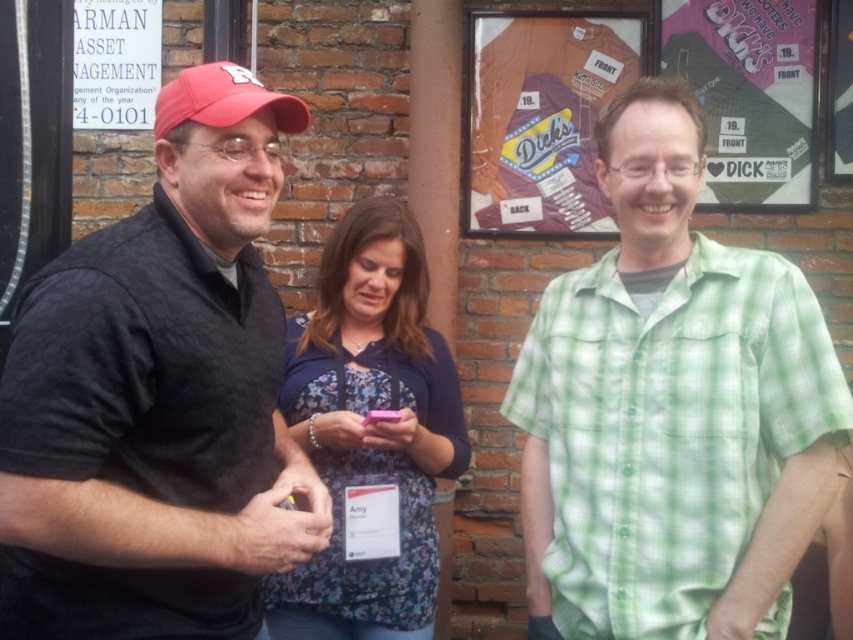
You are a photographer trying to capture a group photo of the three people. You want to ensure that both the green checkered shirt at center and the floral fabric shirt at center are clearly visible. Given their sizes, which shirt should you position closer to the camera to maintain visibility?

The green checkered shirt at center is larger in size than the floral fabric shirt at center. To maintain visibility for both shirts, position the smaller floral fabric shirt at center closer to the camera so it appears larger in the photo, balancing their sizes in the frame.

You are a photographer trying to capture a candid shot of Amy. You notice a point at coordinates (670, 410). Based on the scene description, where exactly is this point located in relation to Amy?

The point at coordinates (670, 410) is located on the green checkered shirt at center, which is the person on the right wearing a light green and white checkered short sleeved shirt and glasses. Amy is the individual in the center with the name tag. Therefore, the point is not on Amy but on the person to her right.